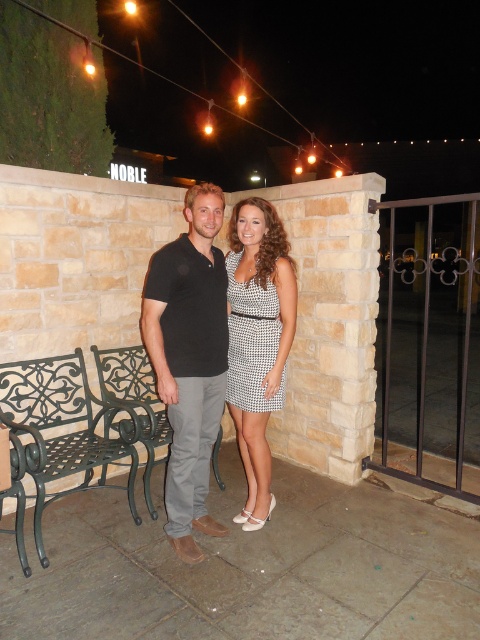
Question: Among these objects, which one is farthest from the camera?

Choices:
 (A) black cotton polo shirt at center
 (B) green cast iron bench at left
 (C) black dotted dress at center
 (D) black wrought iron bench at lower left

Answer: (B)

Question: In this image, where is black dotted dress at center located relative to green cast iron bench at left?

Choices:
 (A) left
 (B) right

Answer: (B)

Question: Is white dotted dress at center thinner than black wrought iron bench at lower left?

Choices:
 (A) yes
 (B) no

Answer: (A)

Question: Can you confirm if black cotton polo shirt at center is bigger than white dotted dress at center?

Choices:
 (A) yes
 (B) no

Answer: (A)

Question: Which point is closer to the camera taking this photo?

Choices:
 (A) (147, 397)
 (B) (233, 298)
 (C) (163, 305)
 (D) (85, 436)

Answer: (C)

Question: Which object is the closest to the green cast iron bench at left?

Choices:
 (A) black dotted dress at center
 (B) white dotted dress at center
 (C) black wrought iron bench at lower left
 (D) black cotton polo shirt at center

Answer: (C)